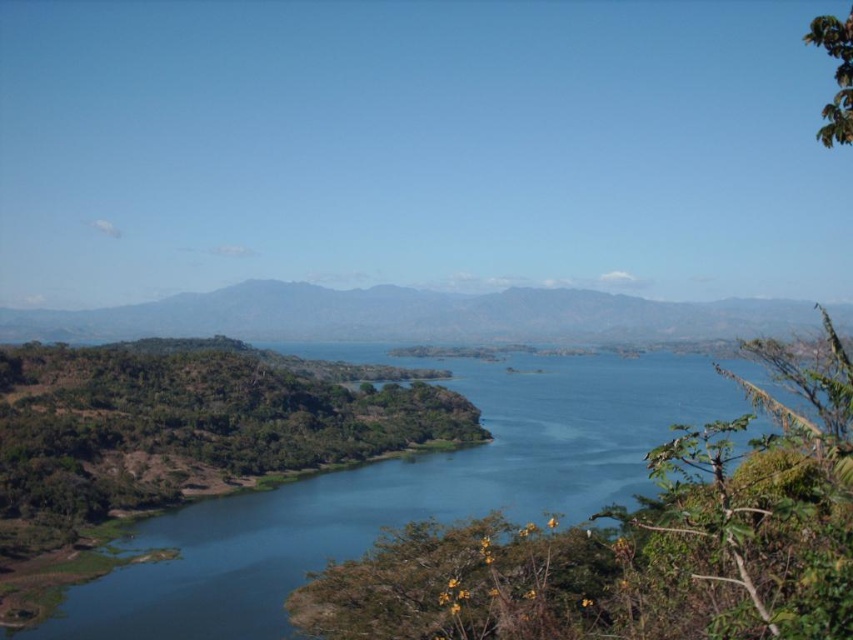
Question: Is blue water at center positioned in front of green matte mountain at center?

Choices:
 (A) yes
 (B) no

Answer: (A)

Question: Which of the following is the farthest from the observer?

Choices:
 (A) (341, 339)
 (B) (303, 538)

Answer: (A)

Question: Does blue water at center appear under green matte mountain at center?

Choices:
 (A) no
 (B) yes

Answer: (B)

Question: Can you confirm if blue water at center is positioned to the right of green matte mountain at center?

Choices:
 (A) yes
 (B) no

Answer: (A)